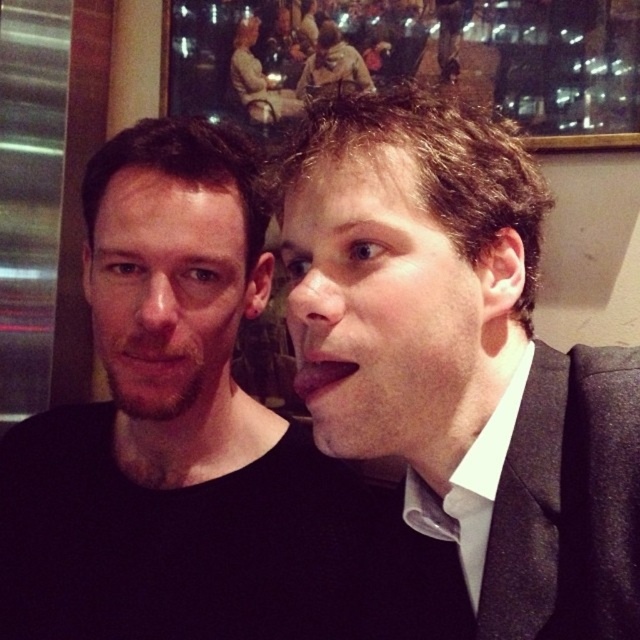
You are a photographer setting up for a portrait. You notice two subjects in the scene described. The first is a bearded man at left, and the second is a black matte shirt at left. From the photographer perspective, which subject is positioned more to the left?

The bearded man at left is positioned more to the left because the black matte shirt at left is to the right of him.

You are a photographer trying to capture a portrait of both the dark brown hair at right and the bearded man at left. Since you want to ensure both subjects are in focus, which subject should you focus on to account for their height difference?

You should focus on the dark brown hair at right because it is much taller than the bearded man at left, so focusing on the taller subject will help ensure both are in focus.

You are a photographer trying to focus on the bearded man at left and the black matte shirt at left in the image. Which object is positioned lower in the frame?

The black matte shirt at left is located below the bearded man at left, so it is positioned lower in the frame.